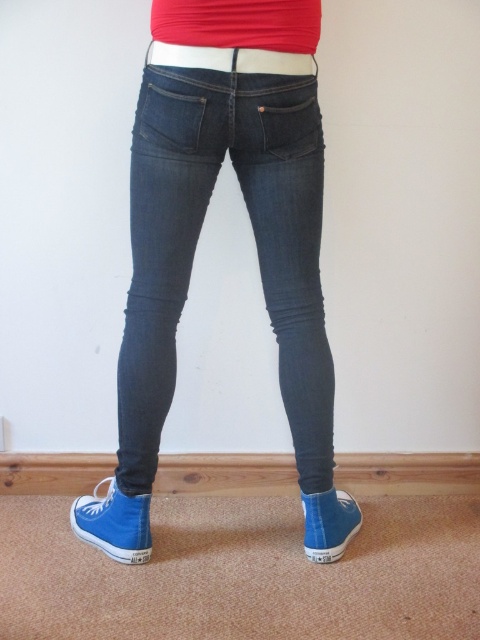
Question: Which point is farther to the camera?

Choices:
 (A) dark blue denim jeans at center
 (B) white fabric belt at center

Answer: (A)

Question: In this image, where is dark blue denim jeans at center located relative to white fabric belt at center?

Choices:
 (A) right
 (B) left

Answer: (B)

Question: Which point is farther from the camera taking this photo?

Choices:
 (A) pos(225,118)
 (B) pos(187,60)

Answer: (A)

Question: Can you confirm if dark blue denim jeans at center is positioned below white fabric belt at center?

Choices:
 (A) yes
 (B) no

Answer: (A)

Question: Which object is farther from the camera taking this photo?

Choices:
 (A) dark blue denim jeans at center
 (B) white fabric belt at center

Answer: (A)

Question: Does dark blue denim jeans at center have a larger size compared to white fabric belt at center?

Choices:
 (A) yes
 (B) no

Answer: (A)